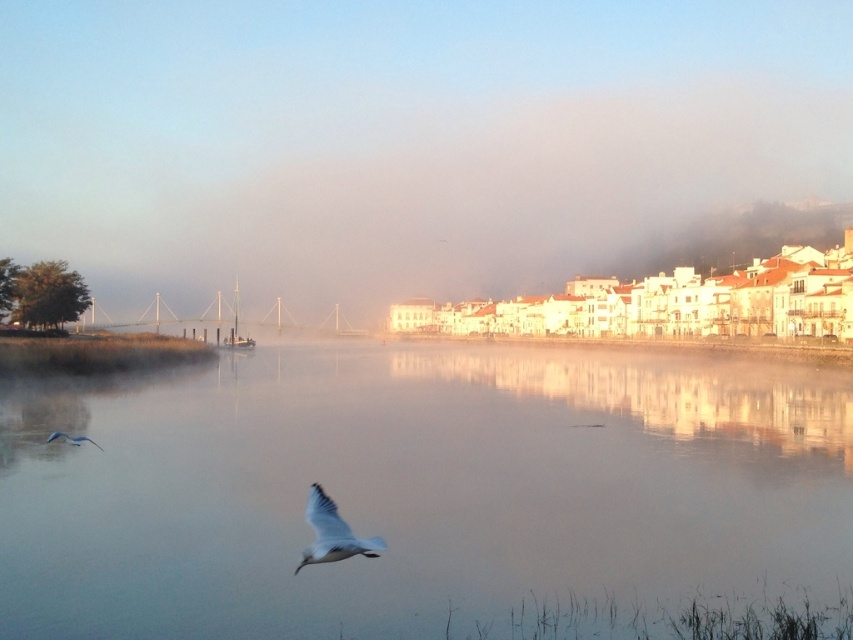
Question: Which point is farther to the camera?

Choices:
 (A) (779, 444)
 (B) (88, 440)
 (C) (235, 321)

Answer: (C)

Question: Which of the following is the closest to the observer?

Choices:
 (A) white matte bird at lower center
 (B) clear water at center
 (C) white matte bird at lower left
 (D) foggy mist at center

Answer: (B)

Question: Is clear water at center to the left of metallic gray boat at center from the viewer's perspective?

Choices:
 (A) yes
 (B) no

Answer: (B)

Question: Is foggy mist at center in front of clear water at center?

Choices:
 (A) no
 (B) yes

Answer: (A)

Question: Does foggy mist at center have a larger size compared to metallic gray boat at center?

Choices:
 (A) yes
 (B) no

Answer: (A)

Question: Which point is closer to the camera?

Choices:
 (A) (335, 557)
 (B) (25, 17)
 (C) (74, 436)

Answer: (A)